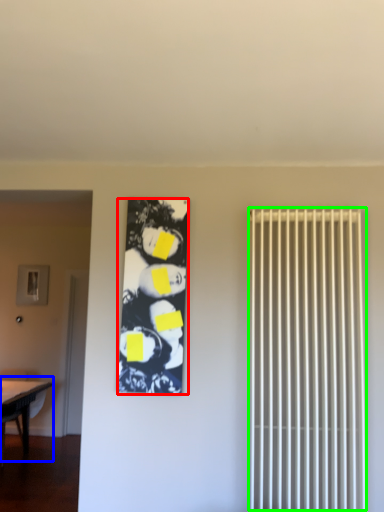
Question: Considering the real-world distances, which object is closest to couple (highlighted by a red box)? table (highlighted by a blue box) or radiator (highlighted by a green box).

Choices:
 (A) table
 (B) radiator

Answer: (B)